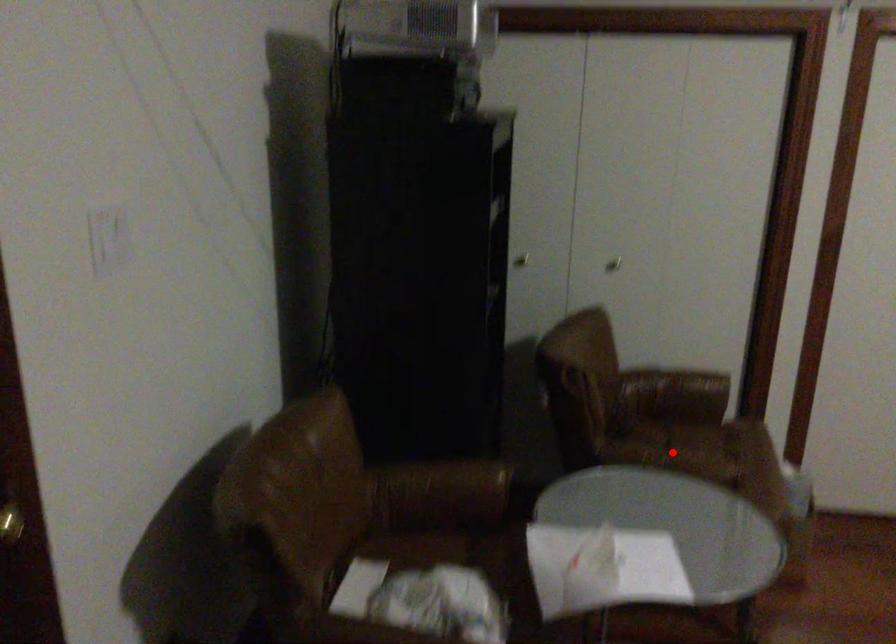
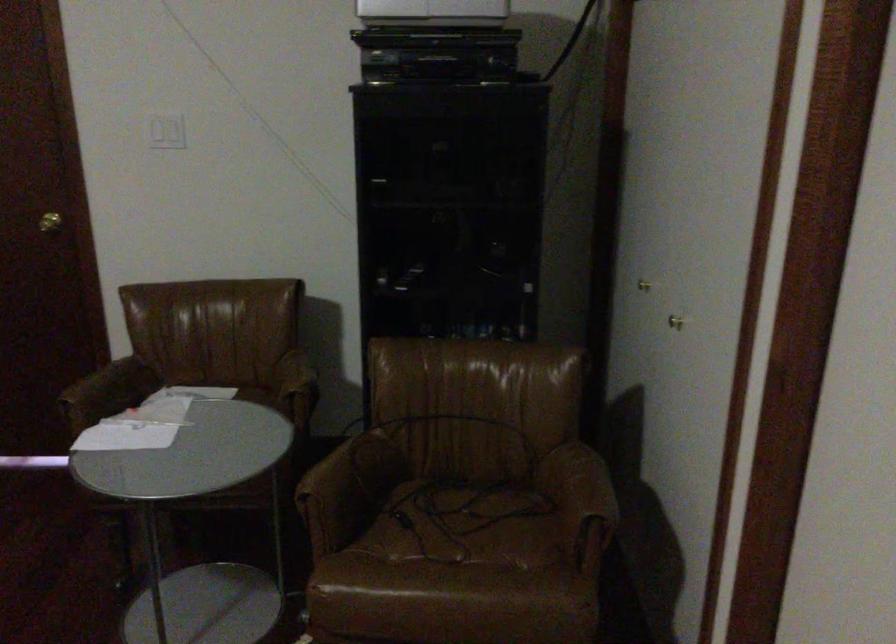
In the second image, find the point that corresponds to the highlighted location in the first image.

(464, 525)